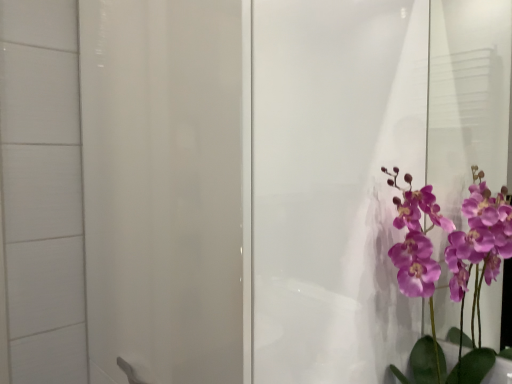
Find the location of `purple glossy orchid at right`. purple glossy orchid at right is located at coordinates (450, 237).

Image resolution: width=512 pixels, height=384 pixels. Describe the element at coordinates (450, 237) in the screenshot. I see `purple glossy orchid at right` at that location.

This screenshot has width=512, height=384. In order to click on purple glossy orchid at right in this screenshot , I will do `click(450, 237)`.